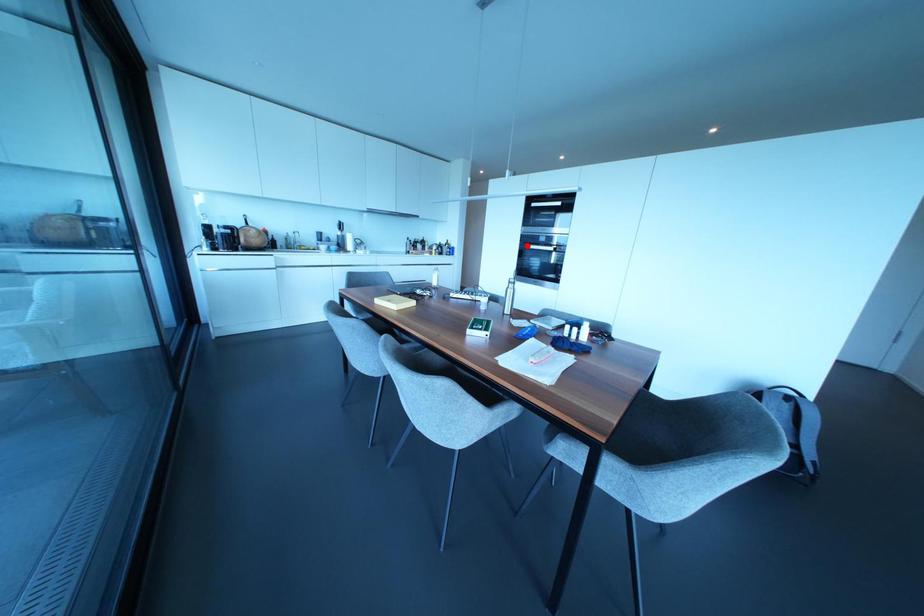
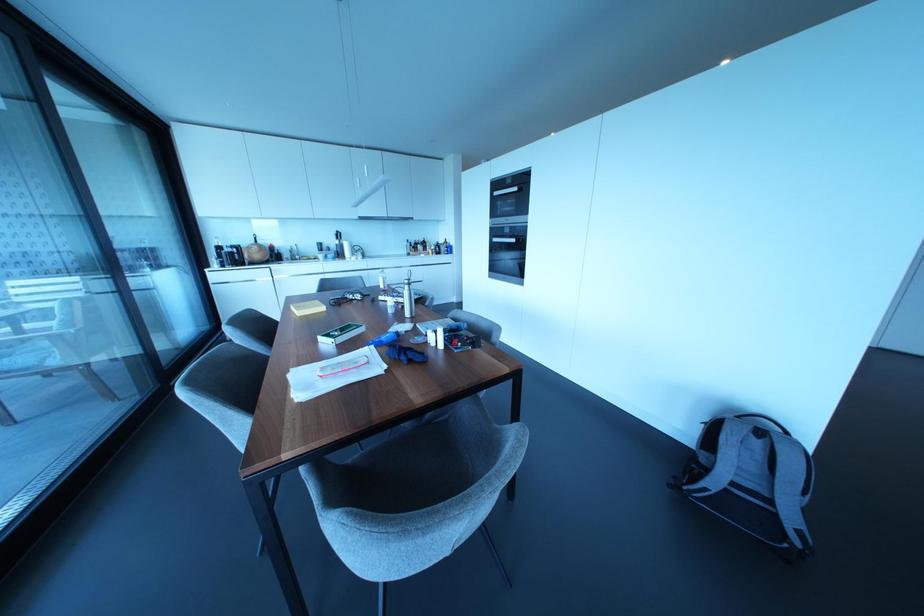
Where in the second image is the point corresponding to the highlighted location from the first image?

(493, 238)